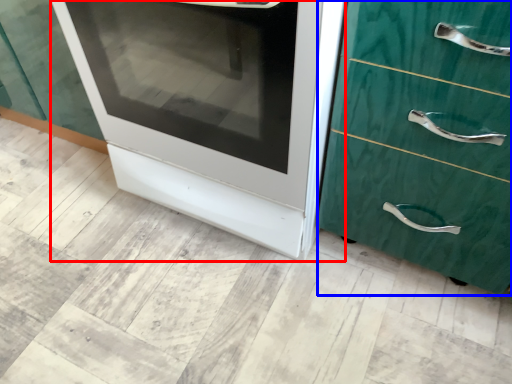
Question: Which point is closer to the camera, oven (highlighted by a red box) or chest of drawers (highlighted by a blue box)?

Choices:
 (A) oven
 (B) chest of drawers

Answer: (B)